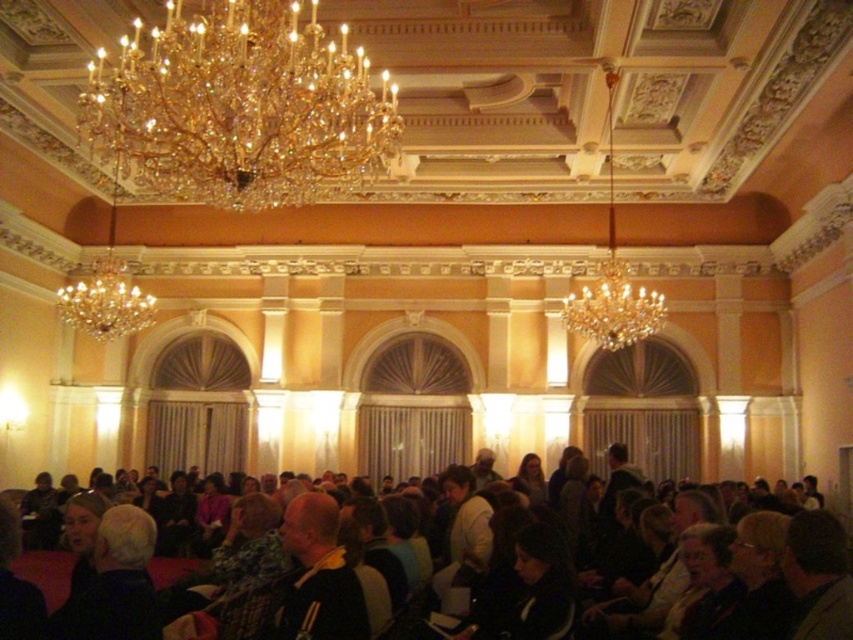
Is gold crystal chandelier at upper center thinner than crystal glass chandelier at upper left?

No, gold crystal chandelier at upper center is not thinner than crystal glass chandelier at upper left.

Can you confirm if gold crystal chandelier at upper center is positioned below crystal glass chandelier at upper left?

No, gold crystal chandelier at upper center is not below crystal glass chandelier at upper left.

Find the location of a particular element. This screenshot has width=853, height=640. gold crystal chandelier at upper center is located at coordinates (238, 108).

Looking at this image, does dark clothing crowd at center have a lesser height compared to dark brown hair at center?

No.

Does point (59, 552) lie behind point (512, 477)?

That is False.

In order to click on dark clothing crowd at center in this screenshot , I will do click(45, 572).

Where is `dark clothing crowd at center`? dark clothing crowd at center is located at coordinates (45, 572).

Which is more to the left, dark brown hair at lower right or crystal glass chandelier at upper left?

Positioned to the left is crystal glass chandelier at upper left.

Locate an element on the screen. dark brown hair at lower right is located at coordinates (817, 576).

At what (x,y) coordinates should I click in order to perform the action: click on dark brown hair at lower right. Please return your answer as a coordinate pair (x, y). Looking at the image, I should click on (817, 576).